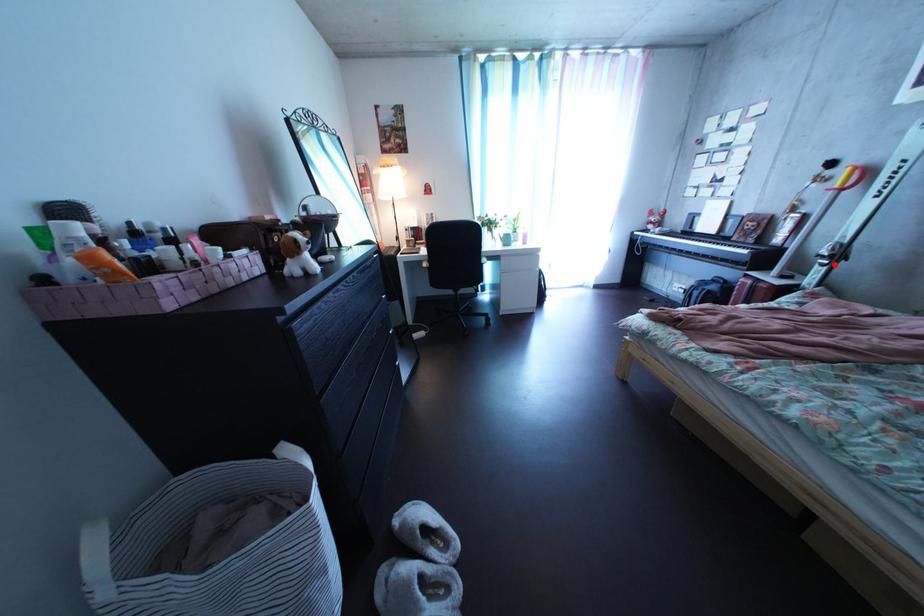
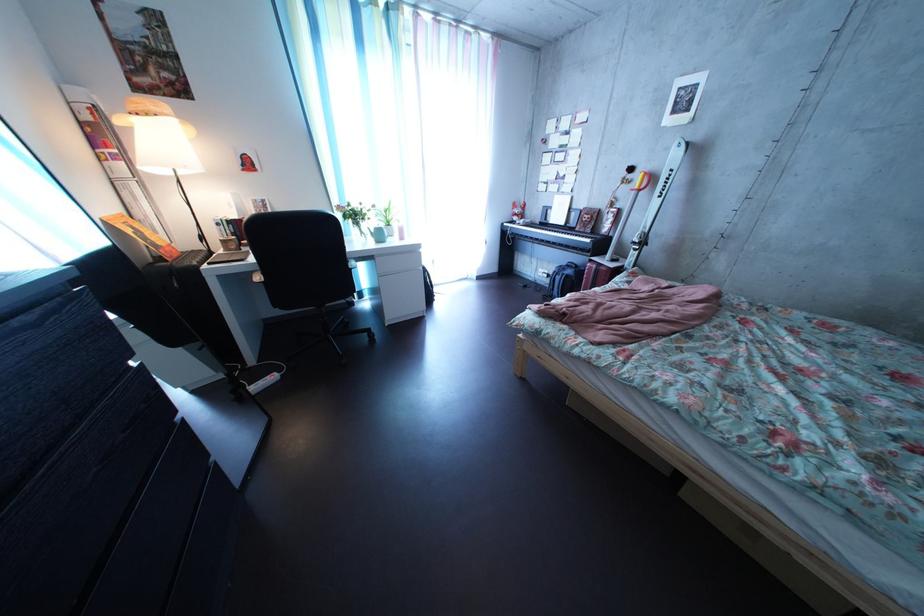
Question: I am providing you with two images of the same scene from different viewpoints. Given a red point in image1, look at the same physical point in image2. Is it:

Choices:
 (A) Closer to the viewpoint
 (B) Farther from the viewpoint

Answer: (A)